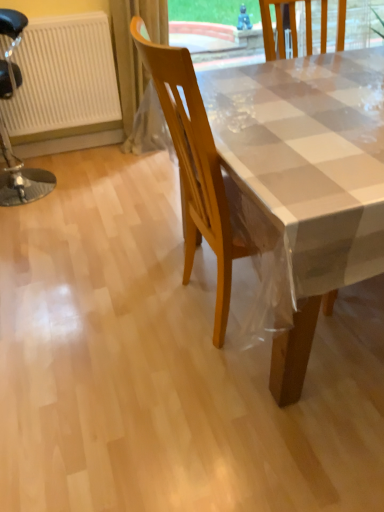
Question: Should I look upward or downward to see white textured radiator at left?

Choices:
 (A) up
 (B) down

Answer: (A)

Question: Is translucent plastic curtain at upper left next to wooden chair at center, the second chair from the left?

Choices:
 (A) yes
 (B) no

Answer: (B)

Question: Is translucent plastic curtain at upper left smaller than wooden chair at center, the first chair positioned from the front?

Choices:
 (A) yes
 (B) no

Answer: (A)

Question: Is translucent plastic curtain at upper left not inside wooden chair at center, the first chair positioned from the front?

Choices:
 (A) yes
 (B) no

Answer: (A)

Question: Does translucent plastic curtain at upper left have a larger size compared to wooden chair at center, the second chair from the left?

Choices:
 (A) yes
 (B) no

Answer: (B)

Question: Does translucent plastic curtain at upper left have a greater height compared to wooden chair at center, which is counted as the second chair, starting from the back?

Choices:
 (A) yes
 (B) no

Answer: (B)

Question: From a real-world perspective, is translucent plastic curtain at upper left beneath wooden chair at center, the second chair from the left?

Choices:
 (A) no
 (B) yes

Answer: (B)

Question: From a real-world perspective, is translucent plastic curtain at upper left under black leather stool at left, which appears as the 1th chair when viewed from the back?

Choices:
 (A) yes
 (B) no

Answer: (A)

Question: Does translucent plastic curtain at upper left have a greater width compared to black leather stool at left, positioned as the second chair in right-to-left order?

Choices:
 (A) yes
 (B) no

Answer: (B)

Question: Can you confirm if translucent plastic curtain at upper left is shorter than black leather stool at left, placed as the 2th chair when sorted from front to back?

Choices:
 (A) yes
 (B) no

Answer: (A)

Question: Does translucent plastic curtain at upper left have a lesser width compared to black leather stool at left, which is the 1th chair from left to right?

Choices:
 (A) yes
 (B) no

Answer: (A)

Question: Is translucent plastic curtain at upper left positioned beyond the bounds of black leather stool at left, positioned as the second chair in right-to-left order?

Choices:
 (A) yes
 (B) no

Answer: (A)

Question: Is translucent plastic curtain at upper left at the left side of black leather stool at left, placed as the 2th chair when sorted from front to back?

Choices:
 (A) yes
 (B) no

Answer: (B)

Question: Does white textured radiator at left appear on the left side of black leather stool at left, positioned as the second chair in right-to-left order?

Choices:
 (A) no
 (B) yes

Answer: (A)